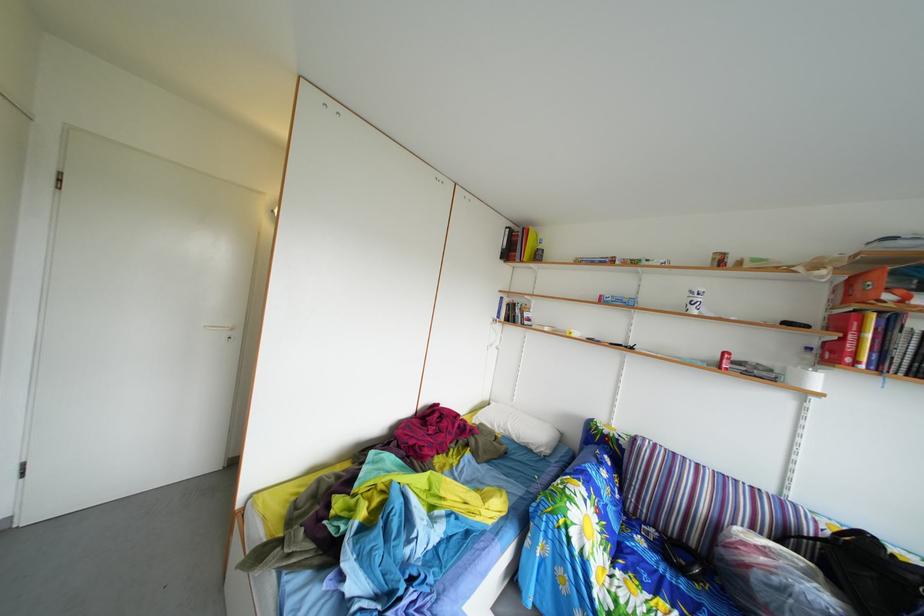
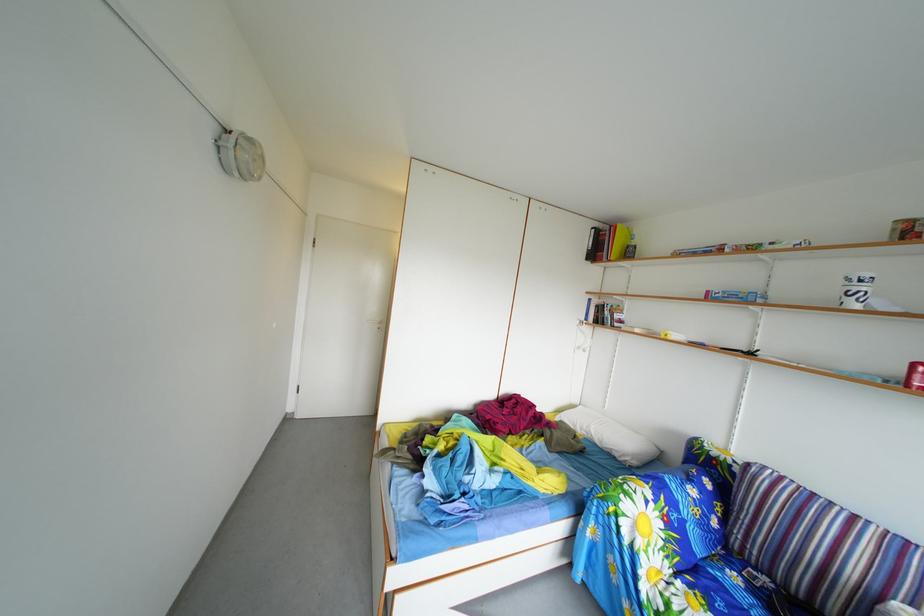
Find the pixel in the second image that matches [650,548] in the first image.

(746, 585)